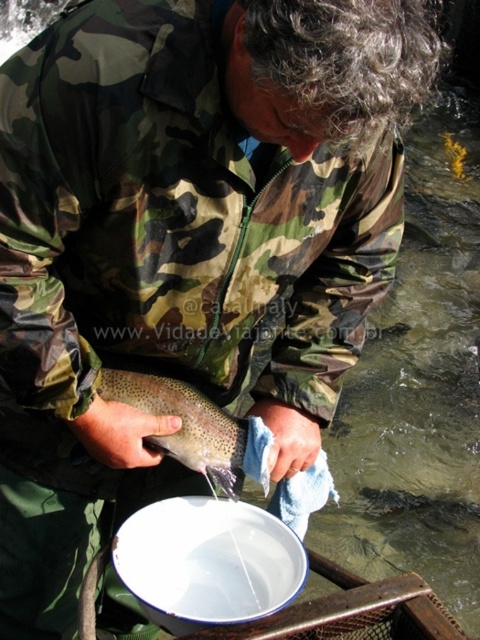
You are a chef preparing to serve a meal and need to place a decorative item on the white enamel plate at lower center. Your reach extends 1.1 meters. Can you comfortably place the item on the plate without moving closer?

The white enamel plate at lower center is 1.20 meters away from the camera. Since your reach only extends 1.1 meters, you cannot comfortably place the item on the plate without moving closer.

You are a chef preparing to serve a meal. You have a white enamel plate at lower center and a speckled skin fish at center on your counter. The distance between them is crucial for presentation. Can you place the fish on the plate without moving either item, given that the plate is exactly 8.5 inches in diameter?

The white enamel plate at lower center and speckled skin fish at center are 8.53 inches apart. Since the plate is 8.5 inches in diameter, the fish would need to be placed within the plate area. However, the distance between them is slightly larger than the plate diameter, so the fish cannot be placed on the plate without moving either item.